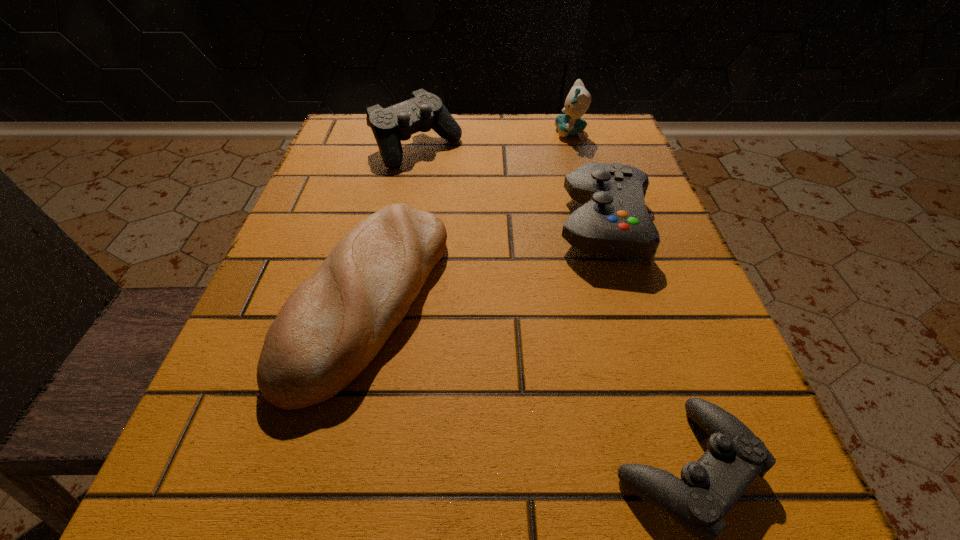
The image size is (960, 540). What are the coordinates of `vacant area at the left edge` in the screenshot? It's located at (195, 435).

This screenshot has width=960, height=540. Find the location of `vacant space at the right edge of the desktop`. vacant space at the right edge of the desktop is located at coordinates (641, 299).

You are a GUI agent. You are given a task and a screenshot of the screen. Output one action in this format:
    pyautogui.click(x=<x>, y=<y>)
    Task: Click on the vacant point at the far left corner
    This screenshot has width=960, height=540.
    Given the screenshot: What is the action you would take?
    pyautogui.click(x=380, y=169)

Where is `vacant space at the near right corner of the desktop`? This screenshot has width=960, height=540. vacant space at the near right corner of the desktop is located at coordinates (760, 529).

You are a GUI agent. You are given a task and a screenshot of the screen. Output one action in this format:
    pyautogui.click(x=<x>, y=<y>)
    Task: Click on the free space between the second nearest control and the farthest control
    
    Given the screenshot: What is the action you would take?
    pyautogui.click(x=510, y=187)

I want to click on vacant space that's between the bread and the tallest object, so click(x=469, y=217).

The image size is (960, 540). Find the location of `free point between the kitten and the leftmost control`. free point between the kitten and the leftmost control is located at coordinates (493, 140).

Find the location of a particular element. The width and height of the screenshot is (960, 540). free space between the farthest control and the kitten is located at coordinates (493, 140).

Identify the location of unoccupied position between the farthest control and the kitten. (493, 140).

This screenshot has width=960, height=540. What are the coordinates of `object that is the fourth closest one to the nearest control` in the screenshot? It's located at (578, 100).